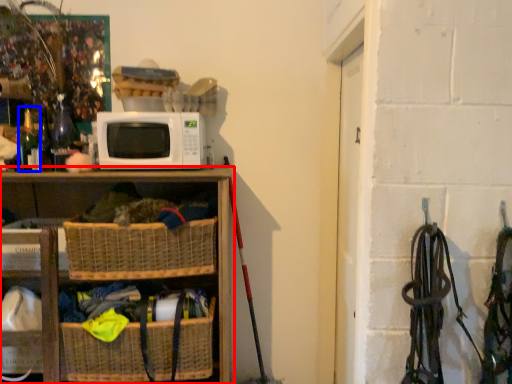
Question: Among these objects, which one is nearest to the camera, shelf (highlighted by a red box) or bottle (highlighted by a blue box)?

Choices:
 (A) shelf
 (B) bottle

Answer: (A)